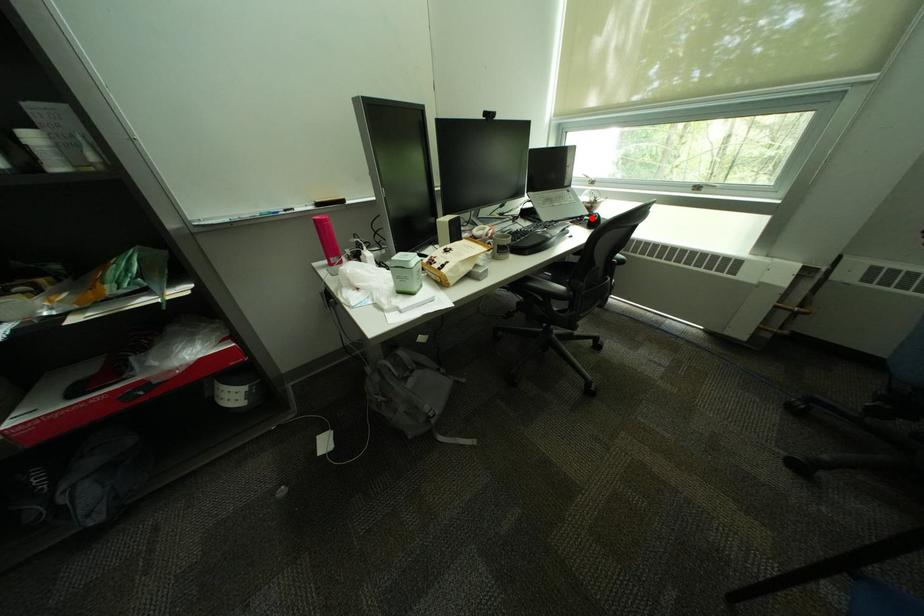
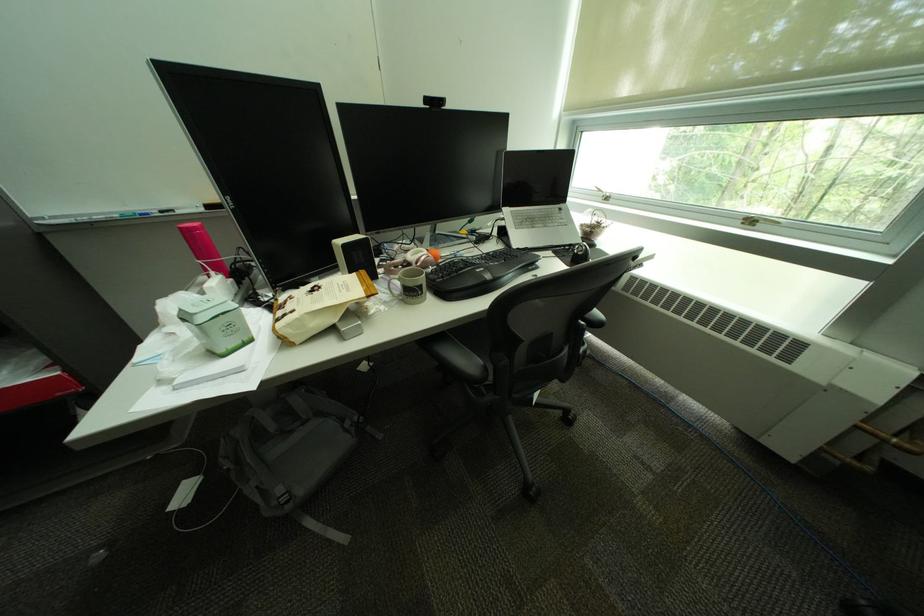
The point at the highlighted location is marked in the first image. Where is the corresponding point in the second image?

(580, 246)